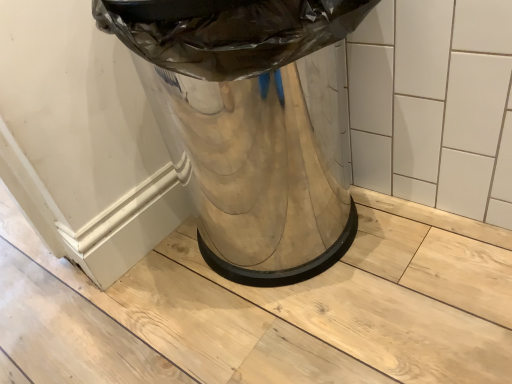
Question: Is white glossy tile at upper center further to camera compared to shiny metallic trash can at center?

Choices:
 (A) no
 (B) yes

Answer: (B)

Question: Is white glossy tile at upper center closer to camera compared to shiny metallic trash can at center?

Choices:
 (A) yes
 (B) no

Answer: (B)

Question: Considering the relative sizes of white glossy tile at upper center and shiny metallic trash can at center in the image provided, is white glossy tile at upper center thinner than shiny metallic trash can at center?

Choices:
 (A) no
 (B) yes

Answer: (B)

Question: From the image's perspective, is white glossy tile at upper center over shiny metallic trash can at center?

Choices:
 (A) no
 (B) yes

Answer: (B)

Question: Is white glossy tile at upper center bigger than shiny metallic trash can at center?

Choices:
 (A) yes
 (B) no

Answer: (B)

Question: From a real-world perspective, is white glossy tile at upper center under shiny metallic trash can at center?

Choices:
 (A) yes
 (B) no

Answer: (A)

Question: From the image's perspective, would you say shiny metallic trash can at center is shown under white glossy tile at upper center?

Choices:
 (A) yes
 (B) no

Answer: (A)

Question: Is shiny metallic trash can at center positioned with its back to white glossy tile at upper center?

Choices:
 (A) yes
 (B) no

Answer: (B)

Question: Can you see shiny metallic trash can at center touching white glossy tile at upper center?

Choices:
 (A) no
 (B) yes

Answer: (A)

Question: Can you confirm if shiny metallic trash can at center is thinner than white glossy tile at upper center?

Choices:
 (A) yes
 (B) no

Answer: (B)

Question: Is shiny metallic trash can at center not near white glossy tile at upper center?

Choices:
 (A) yes
 (B) no

Answer: (B)

Question: From a real-world perspective, is shiny metallic trash can at center physically above white glossy tile at upper center?

Choices:
 (A) no
 (B) yes

Answer: (B)

Question: Is shiny metallic trash can at center inside or outside of white glossy tile at upper center?

Choices:
 (A) inside
 (B) outside

Answer: (B)